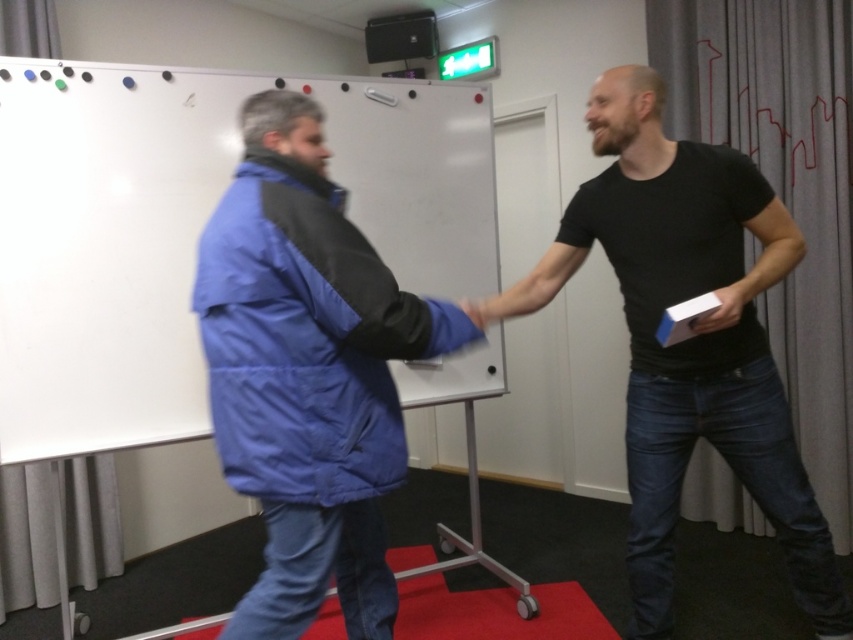
Is white matte board at center above matte black hand at center?

Indeed, white matte board at center is positioned over matte black hand at center.

Describe the element at coordinates (190, 228) in the screenshot. The width and height of the screenshot is (853, 640). I see `white matte board at center` at that location.

Is point (61, 252) farther from camera compared to point (474, 301)?

That is False.

At what (x,y) coordinates should I click in order to perform the action: click on white matte board at center. Please return your answer as a coordinate pair (x, y). This screenshot has width=853, height=640. Looking at the image, I should click on [x=190, y=228].

Can you confirm if black matte shirt at center is wider than matte black hand at center?

Correct, the width of black matte shirt at center exceeds that of matte black hand at center.

Who is more distant from viewer, (726,164) or (473,312)?

The point (726,164) is more distant.

The height and width of the screenshot is (640, 853). I want to click on black matte shirt at center, so click(x=689, y=339).

Is point (294, 124) positioned before point (468, 301)?

Yes.

Who is shorter, blue puffy jacket at center or matte black hand at center?

With less height is matte black hand at center.

You are a GUI agent. You are given a task and a screenshot of the screen. Output one action in this format:
    pyautogui.click(x=<x>, y=<y>)
    Task: Click on the blue puffy jacket at center
    Image resolution: width=853 pixels, height=640 pixels.
    Given the screenshot: What is the action you would take?
    pyautogui.click(x=306, y=372)

Where is `blue puffy jacket at center`? This screenshot has width=853, height=640. blue puffy jacket at center is located at coordinates (306, 372).